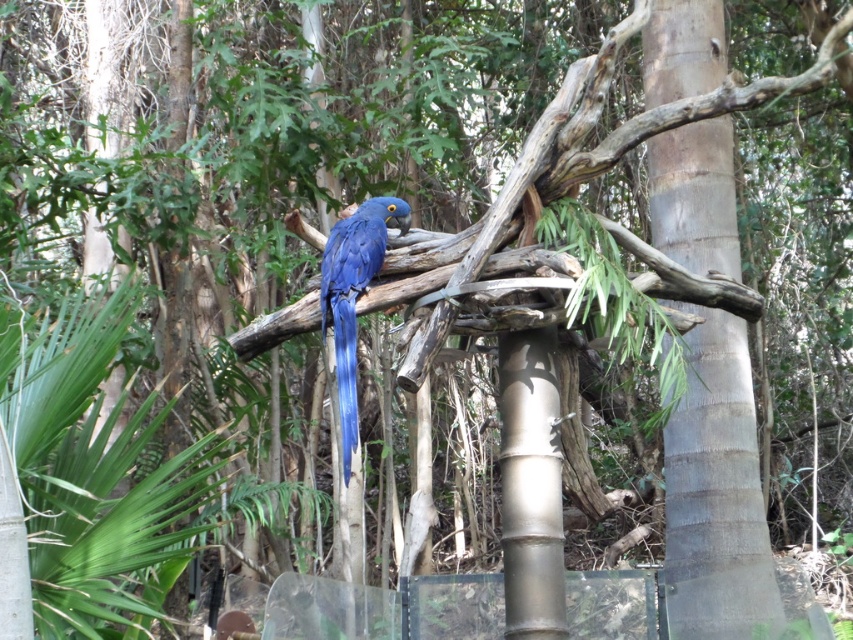
Based on the photo, you are standing in front of the enclosure where the vibrant blue macaw is perched. You notice two points marked in the scene. Which point is closer to you, point (543, 538) or point (323, 262)?

Point (543, 538) is closer to the viewer than point (323, 262).

Based on the photo, you are a birdwatcher trying to identify the width of the smooth gray tree trunk at center and the blue glossy parrot at center. Which object is wider?

The smooth gray tree trunk at center is wider than the blue glossy parrot at center.

You are a bird watching enthusiast standing in front of the enclosure. You notice the smooth gray tree trunk at center and the brushed metal pole at center. Which object is positioned lower in the scene?

The smooth gray tree trunk at center is located below the brushed metal pole at center, so it is positioned lower in the scene.